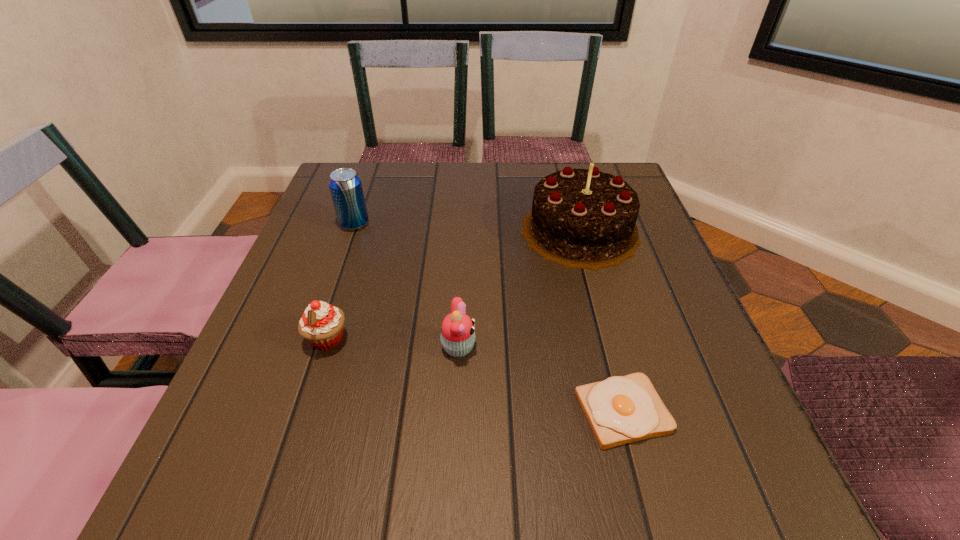
In the image, there is a desktop. At what (x,y) coordinates should I click in order to perform the action: click on vacant space at the right edge. Please return your answer as a coordinate pair (x, y). Looking at the image, I should click on (653, 253).

In the image, there is a desktop. Where is `vacant space at the near left corner`? vacant space at the near left corner is located at coordinates (249, 460).

Locate an element on the screen. empty space between the left cupcake and the right cupcake is located at coordinates (393, 343).

What are the coordinates of `free space between the left cupcake and the birthday cake` in the screenshot? It's located at (453, 285).

Where is `free spot between the left cupcake and the nearest object`? free spot between the left cupcake and the nearest object is located at coordinates (475, 375).

Where is `free point between the third object from left to right and the left cupcake`? free point between the third object from left to right and the left cupcake is located at coordinates (393, 343).

This screenshot has width=960, height=540. I want to click on empty space between the left cupcake and the third object from right to left, so coord(393,343).

Where is `unoccupied area between the tallest object and the third object from right to left`? unoccupied area between the tallest object and the third object from right to left is located at coordinates (519, 289).

The width and height of the screenshot is (960, 540). I want to click on vacant area between the second tallest object and the left cupcake, so pos(341,282).

What are the coordinates of `empty space between the tallest object and the left cupcake` in the screenshot? It's located at (453, 285).